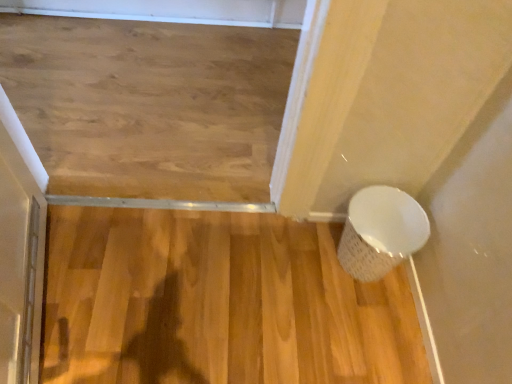
The height and width of the screenshot is (384, 512). Describe the element at coordinates (381, 232) in the screenshot. I see `white textured basket at lower right` at that location.

You are a GUI agent. You are given a task and a screenshot of the screen. Output one action in this format:
    pyautogui.click(x=<x>, y=<y>)
    Task: Click on the white textured basket at lower right
    The image size is (512, 384).
    Given the screenshot: What is the action you would take?
    pyautogui.click(x=381, y=232)

Identify the location of natural wood floor at center. (217, 303).

The image size is (512, 384). What do you see at coordinates (217, 303) in the screenshot?
I see `natural wood floor at center` at bounding box center [217, 303].

In the scene shown: In order to face natural wood floor at center, should I rotate leftwards or rightwards?

To align with it, rotate left about 6.287°.

This screenshot has width=512, height=384. I want to click on white textured basket at lower right, so tap(381, 232).

From the picture: Which is more to the right, natural wood floor at center or white textured basket at lower right?

From the viewer's perspective, white textured basket at lower right appears more on the right side.

Considering their positions, is natural wood floor at center located in front of or behind white textured basket at lower right?

In the image, natural wood floor at center appears in front of white textured basket at lower right.

Is point (47, 248) farther from camera compared to point (372, 222)?

No, (47, 248) is in front of (372, 222).

From the image's perspective, which is below, natural wood floor at center or white textured basket at lower right?

natural wood floor at center.

From the picture: From a real-world perspective, does natural wood floor at center sit lower than white textured basket at lower right?

Yes, from a real-world perspective, natural wood floor at center is beneath white textured basket at lower right.

Does natural wood floor at center have a greater width compared to white textured basket at lower right?

Yes, natural wood floor at center is wider than white textured basket at lower right.

Is natural wood floor at center taller than white textured basket at lower right?

No.

Looking at the image, does natural wood floor at center seem bigger or smaller compared to white textured basket at lower right?

Clearly, natural wood floor at center is larger in size than white textured basket at lower right.

In the scene shown: Can white textured basket at lower right be found inside natural wood floor at center?

No, white textured basket at lower right is not surrounded by natural wood floor at center.

In the scene shown: Does natural wood floor at center touch white textured basket at lower right?

natural wood floor at center and white textured basket at lower right are clearly separated.

Is natural wood floor at center positioned with its back to white textured basket at lower right?

natural wood floor at center is not turned away from white textured basket at lower right.

How many degrees apart are the facing directions of natural wood floor at center and white textured basket at lower right?

180 degrees separate the facing orientations of natural wood floor at center and white textured basket at lower right.

Identify the location of hardwood beneath the white textured basket at lower right (from a real-world perspective). (217, 303).

Considering the positions of objects white textured basket at lower right and natural wood floor at center in the image provided, who is more to the left, white textured basket at lower right or natural wood floor at center?

natural wood floor at center.

Which object is closer to the camera, white textured basket at lower right or natural wood floor at center?

natural wood floor at center is closer to the camera.

In the scene shown: Which is farther from the camera, (x=400, y=206) or (x=161, y=286)?

Positioned behind is point (x=400, y=206).

In the scene shown: From the image's perspective, which one is positioned higher, white textured basket at lower right or natural wood floor at center?

white textured basket at lower right is shown above in the image.

From a real-world perspective, is white textured basket at lower right physically located above or below natural wood floor at center?

From a real-world perspective, white textured basket at lower right is physically above natural wood floor at center.

Is white textured basket at lower right wider than natural wood floor at center?

No.

Based on the photo, can you confirm if white textured basket at lower right is shorter than natural wood floor at center?

No.

Based on their sizes in the image, would you say white textured basket at lower right is bigger or smaller than natural wood floor at center?

white textured basket at lower right is smaller than natural wood floor at center.

Do you think white textured basket at lower right is within natural wood floor at center, or outside of it?

white textured basket at lower right lies outside natural wood floor at center.

Would you consider white textured basket at lower right to be distant from natural wood floor at center?

No, white textured basket at lower right is not far from natural wood floor at center.

Is white textured basket at lower right facing towards natural wood floor at center?

No, white textured basket at lower right does not turn towards natural wood floor at center.

How much distance is there between white textured basket at lower right and natural wood floor at center?

12.69 inches.

The height and width of the screenshot is (384, 512). Identify the location of toilet to the right of natural wood floor at center. (381, 232).

Locate an element on the screen. toilet above the natural wood floor at center (from the image's perspective) is located at coordinates (381, 232).

The width and height of the screenshot is (512, 384). What are the coordinates of `hardwood below the white textured basket at lower right (from the image's perspective)` in the screenshot? It's located at (217, 303).